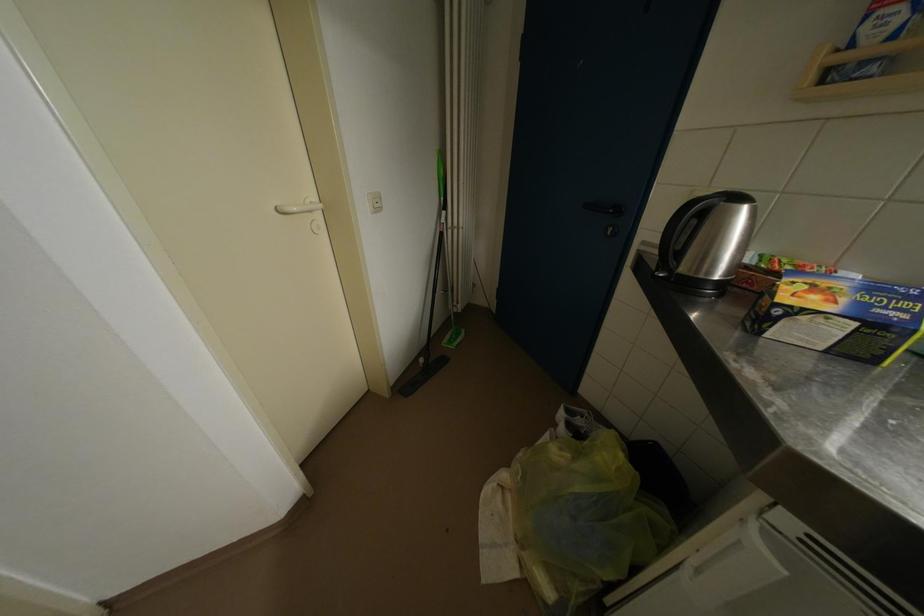
The image size is (924, 616). I want to click on refrigerator handle, so click(733, 570).